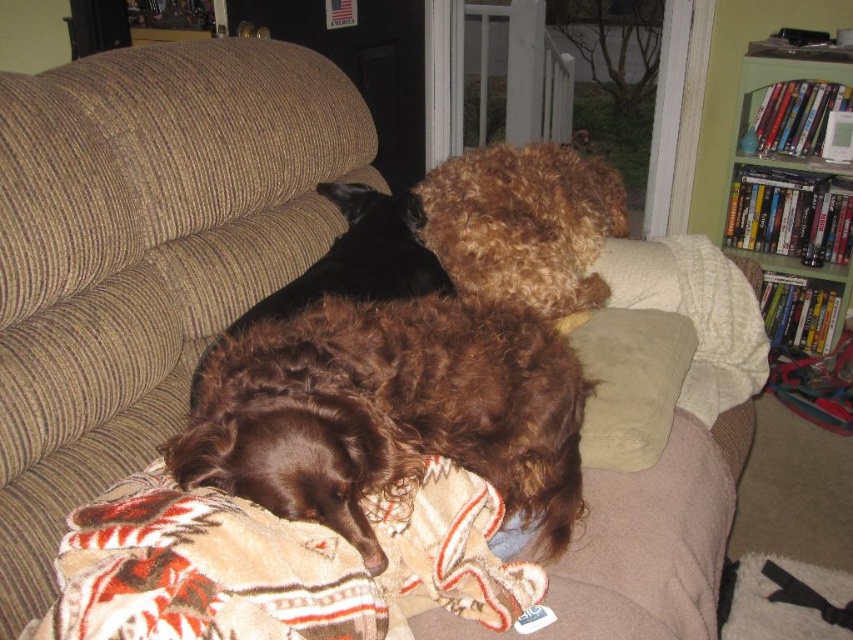
Question: Which of the following is the farthest from the observer?

Choices:
 (A) brown curly fur dog at center
 (B) suede-like beige pillow at center
 (C) green wooden bookshelf at upper right
 (D) plush beige blanket at lower center

Answer: (C)

Question: Which of these objects is positioned closest to the suede-like beige pillow at center?

Choices:
 (A) brown curly fur dog at center
 (B) plush beige blanket at lower center
 (C) green wooden bookshelf at upper right

Answer: (A)

Question: Can you confirm if brown curly fur dog at center is positioned to the left of plush beige blanket at lower center?

Choices:
 (A) no
 (B) yes

Answer: (A)

Question: Is green wooden bookshelf at upper right smaller than suede-like beige pillow at center?

Choices:
 (A) no
 (B) yes

Answer: (A)

Question: Where is brown curly fur dog at center located in relation to plush beige blanket at lower center in the image?

Choices:
 (A) right
 (B) left

Answer: (A)

Question: Which object is positioned closest to the green wooden bookshelf at upper right?

Choices:
 (A) plush beige blanket at lower center
 (B) suede-like beige pillow at center

Answer: (B)